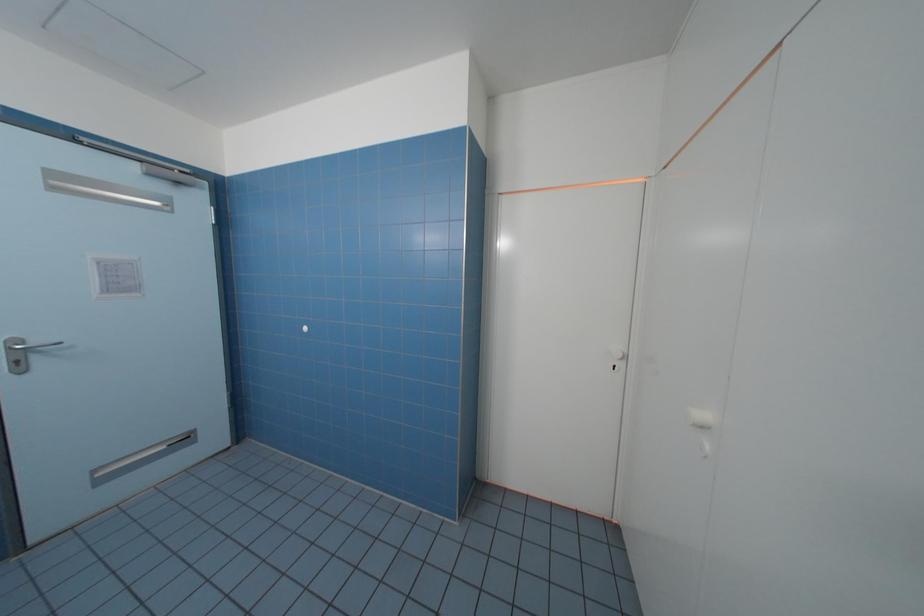
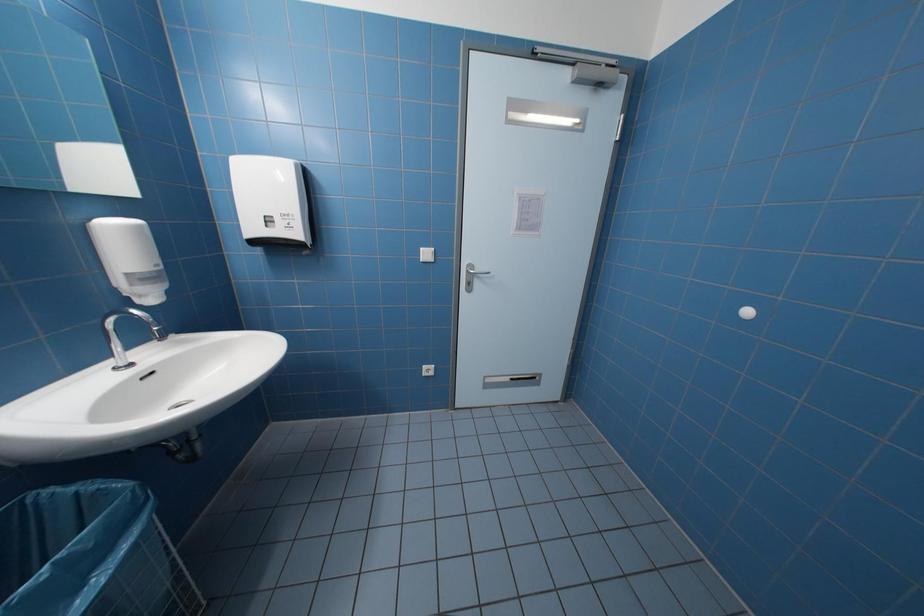
Question: The camera is either moving clockwise (left) or counter-clockwise (right) around the object. The first image is from the beginning of the video and the second image is from the end. Is the camera moving left or right when shooting the video?

Choices:
 (A) Left
 (B) Right

Answer: (B)